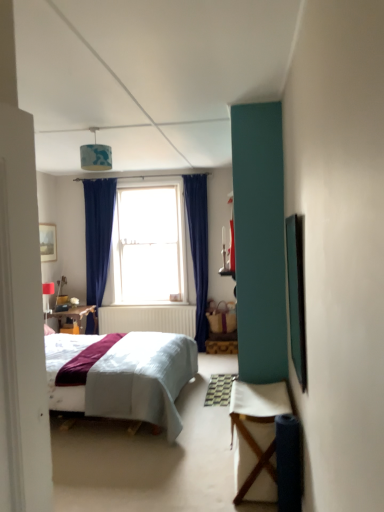
You are a GUI agent. You are given a task and a screenshot of the screen. Output one action in this format:
    pyautogui.click(x=<x>, y=<y>)
    Task: Click on the free space above blue fabric lampshade at upper center, arranged as the 2th lamp when ordered from the bottom (from a real-world perspective)
    The image size is (384, 512).
    Given the screenshot: What is the action you would take?
    pyautogui.click(x=93, y=130)